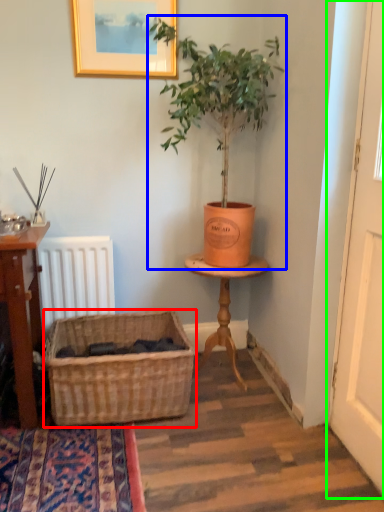
Question: Which object is the farthest from basket (highlighted by a red box)? Choose among these: houseplant (highlighted by a blue box) or screen door (highlighted by a green box).

Choices:
 (A) houseplant
 (B) screen door

Answer: (B)